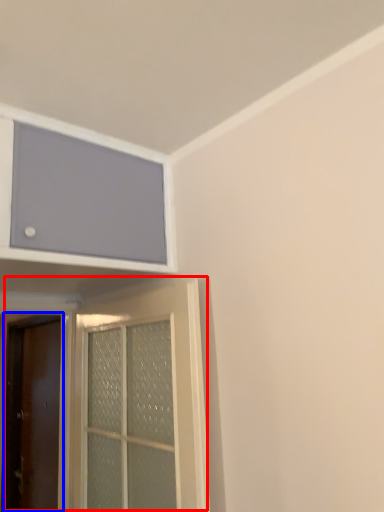
Question: Among these objects, which one is nearest to the camera, door (highlighted by a red box) or door (highlighted by a blue box)?

Choices:
 (A) door
 (B) door

Answer: (A)